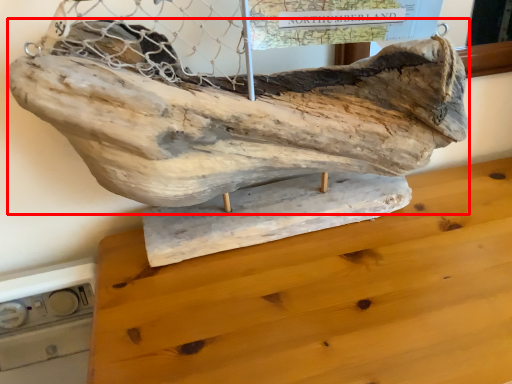
Question: From the image's perspective, considering the relative positions of sculpture (annotated by the red box) and furniture in the image provided, where is sculpture (annotated by the red box) located with respect to the staircase?

Choices:
 (A) above
 (B) below

Answer: (A)